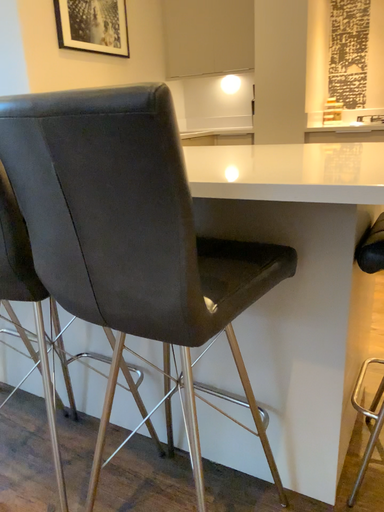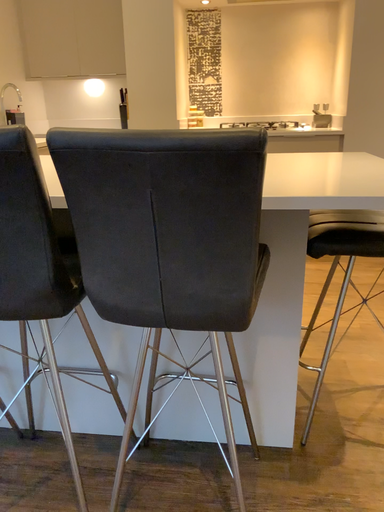
Question: Which way did the camera rotate in the video?

Choices:
 (A) rotated right
 (B) rotated left

Answer: (A)